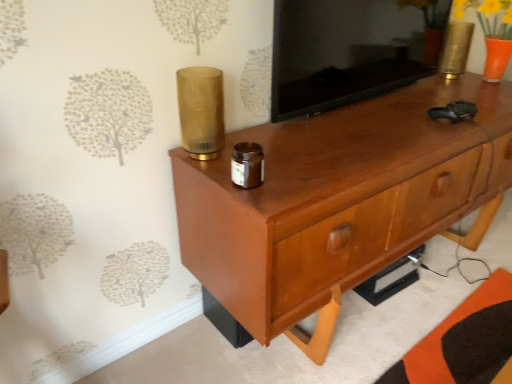
Question: Is matte wood tv cabinet at upper center thinner than gold metallic vase at upper right, the 2th candle holder positioned from the bottom?

Choices:
 (A) no
 (B) yes

Answer: (B)

Question: From a real-world perspective, is matte wood tv cabinet at upper center physically below gold metallic vase at upper right, the first candle holder viewed from the right?

Choices:
 (A) no
 (B) yes

Answer: (A)

Question: Is gold metallic vase at upper right, the 2th candle holder from the front, a part of matte wood tv cabinet at upper center?

Choices:
 (A) no
 (B) yes

Answer: (A)

Question: Does matte wood tv cabinet at upper center turn towards gold metallic vase at upper right, placed as the 1th candle holder when sorted from top to bottom?

Choices:
 (A) no
 (B) yes

Answer: (A)

Question: From the image's perspective, is matte wood tv cabinet at upper center beneath gold metallic vase at upper right, acting as the 2th candle holder starting from the left?

Choices:
 (A) no
 (B) yes

Answer: (B)

Question: Is matte wood tv cabinet at upper center closer to camera compared to gold metallic vase at upper right, placed as the 1th candle holder when sorted from top to bottom?

Choices:
 (A) yes
 (B) no

Answer: (A)

Question: Considering the relative positions of gold metallic vase at upper right, the 1th candle holder viewed from the back, and matte wood tv cabinet at upper center in the image provided, is gold metallic vase at upper right, the 1th candle holder viewed from the back, to the left of matte wood tv cabinet at upper center from the viewer's perspective?

Choices:
 (A) no
 (B) yes

Answer: (A)

Question: From the image's perspective, is gold metallic vase at upper right, the 2th candle holder from the front, below matte wood tv cabinet at upper center?

Choices:
 (A) yes
 (B) no

Answer: (B)

Question: From a real-world perspective, is gold metallic vase at upper right, the 2th candle holder from the front, located beneath matte wood tv cabinet at upper center?

Choices:
 (A) yes
 (B) no

Answer: (A)

Question: Is gold metallic vase at upper right, acting as the 2th candle holder starting from the left, wider than matte wood tv cabinet at upper center?

Choices:
 (A) no
 (B) yes

Answer: (B)

Question: Is gold metallic vase at upper right, the 2th candle holder positioned from the bottom, located outside matte wood tv cabinet at upper center?

Choices:
 (A) no
 (B) yes

Answer: (B)

Question: Would you say gold metallic vase at upper right, the 2th candle holder positioned from the bottom, contains matte wood tv cabinet at upper center?

Choices:
 (A) no
 (B) yes

Answer: (A)

Question: Considering the relative sizes of translucent amber glass at upper center, placed as the 2th candle holder when sorted from back to front, and gold metallic vase at upper right, the 1th candle holder viewed from the back, in the image provided, is translucent amber glass at upper center, placed as the 2th candle holder when sorted from back to front, taller than gold metallic vase at upper right, the 1th candle holder viewed from the back,?

Choices:
 (A) no
 (B) yes

Answer: (B)